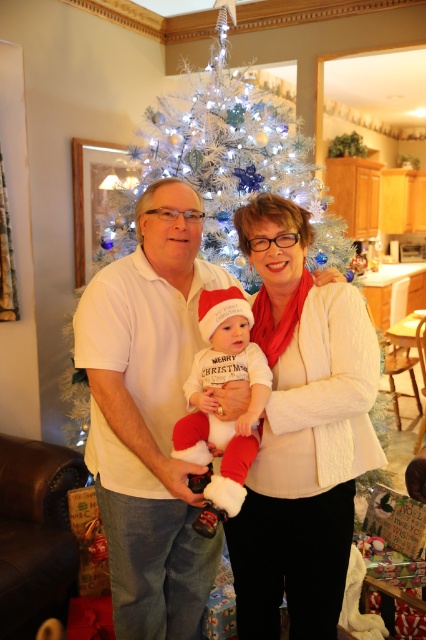
What is the object located at the coordinates point [149,416] in the scene?

The object located at point [149,416] is the white cotton shirt at center.

You are a photographer trying to capture the perfect shot of the family. You notice a point at coordinates (149,416) in the image. What object is located at this point?

The point at coordinates (149,416) indicates the white cotton shirt at center.